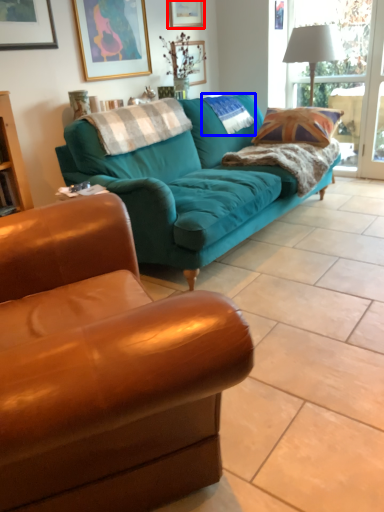
Question: Which of the following is the farthest to the observer, picture frame (highlighted by a red box) or pillow (highlighted by a blue box)?

Choices:
 (A) picture frame
 (B) pillow

Answer: (A)